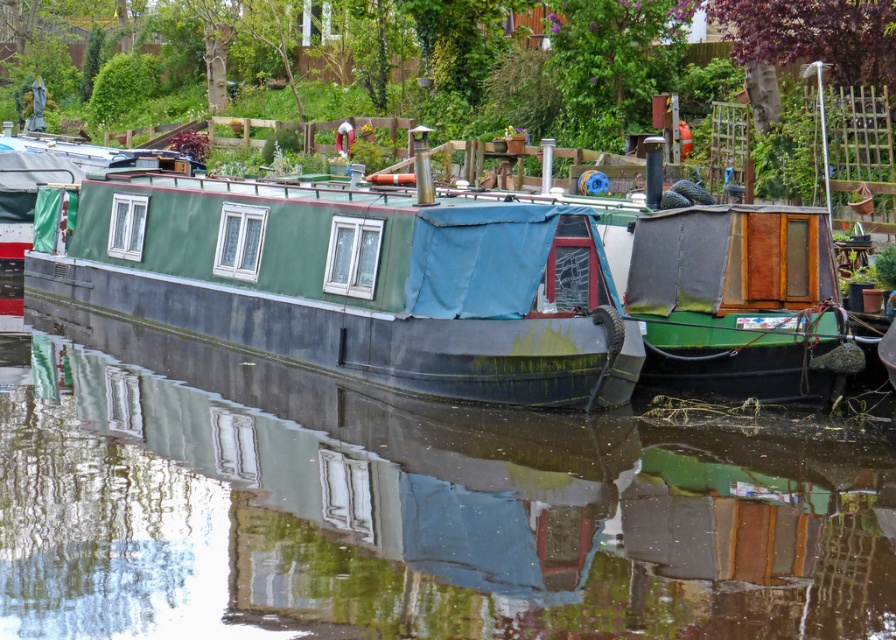
Can you confirm if green matte boat at center is wider than green matte houseboat at center?

Yes.

What do you see at coordinates (401, 508) in the screenshot? I see `green matte boat at center` at bounding box center [401, 508].

Locate an element on the screen. Image resolution: width=896 pixels, height=640 pixels. green matte boat at center is located at coordinates (401, 508).

Which is behind, point (80, 362) or point (778, 298)?

The point (80, 362) is behind.

This screenshot has width=896, height=640. What do you see at coordinates (401, 508) in the screenshot?
I see `green matte boat at center` at bounding box center [401, 508].

At what (x,y) coordinates should I click in order to perform the action: click on green matte boat at center. Please return your answer as a coordinate pair (x, y). The width and height of the screenshot is (896, 640). Looking at the image, I should click on (401, 508).

Can you confirm if green matte houseboat at center is bigger than green canvas boat at right?

Indeed, green matte houseboat at center has a larger size compared to green canvas boat at right.

Between green matte houseboat at center and green canvas boat at right, which one appears on the left side from the viewer's perspective?

From the viewer's perspective, green matte houseboat at center appears more on the left side.

Locate an element on the screen. Image resolution: width=896 pixels, height=640 pixels. green matte houseboat at center is located at coordinates (354, 282).

This screenshot has height=640, width=896. I want to click on green matte houseboat at center, so click(x=354, y=282).